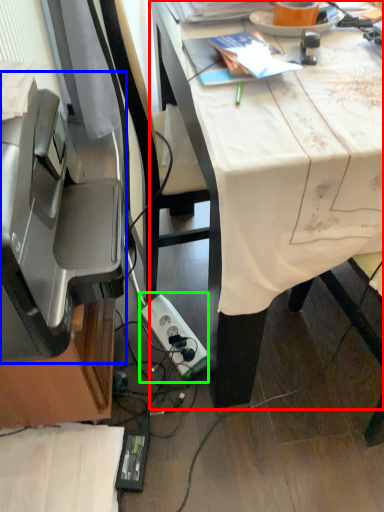
Question: Considering the real-world distances, which object is closest to desk (highlighted by a red box)? printer (highlighted by a blue box) or power plugs and sockets (highlighted by a green box).

Choices:
 (A) printer
 (B) power plugs and sockets

Answer: (A)